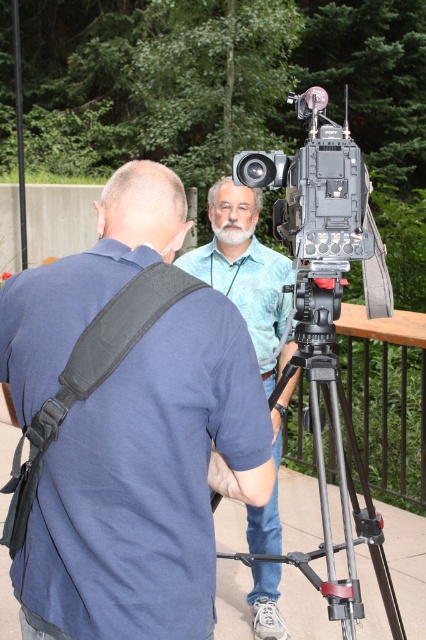
Question: Which object is positioned closest to the blue fabric shirt at center?

Choices:
 (A) blue cotton shirt at upper left
 (B) black metal tripod at center
 (C) black matte video camera at center

Answer: (B)

Question: Does black matte video camera at center have a larger size compared to black metal tripod at center?

Choices:
 (A) no
 (B) yes

Answer: (A)

Question: Is blue cotton shirt at upper left to the right of black matte video camera at center from the viewer's perspective?

Choices:
 (A) yes
 (B) no

Answer: (B)

Question: Among these objects, which one is farthest from the camera?

Choices:
 (A) blue cotton shirt at upper left
 (B) blue fabric shirt at center
 (C) black matte video camera at center

Answer: (B)

Question: Is black matte video camera at center below black metal tripod at center?

Choices:
 (A) yes
 (B) no

Answer: (B)

Question: Which point is farther from the camera taking this photo?

Choices:
 (A) (310, 248)
 (B) (45, 358)

Answer: (A)